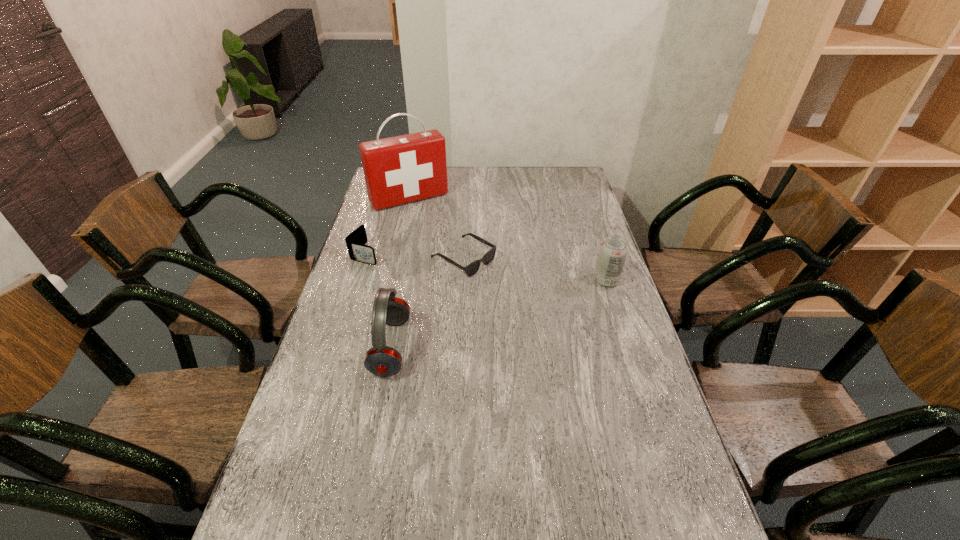
The image size is (960, 540). In order to click on free space located on the ear cups of the nearest object in this screenshot , I will do [x=357, y=347].

This screenshot has height=540, width=960. I want to click on vacant space located 0.390m on the front of the third tallest object, so click(642, 390).

This screenshot has height=540, width=960. I want to click on vacant space positioned at the front lenses of the sunglasses, so (563, 315).

At what (x,y) coordinates should I click in order to perform the action: click on free location located 0.170m at the front lenses of the sunglasses. Please return your answer as a coordinate pair (x, y). Image resolution: width=960 pixels, height=540 pixels. Looking at the image, I should click on point(528,296).

The height and width of the screenshot is (540, 960). I want to click on blank space located at the front lenses of the sunglasses, so click(x=536, y=300).

Locate an element on the screen. This screenshot has height=540, width=960. free location located 0.150m on the outer surface of the fourth tallest object is located at coordinates (416, 269).

This screenshot has height=540, width=960. I want to click on vacant space located on the outer surface of the fourth tallest object, so click(423, 271).

Locate an element on the screen. The image size is (960, 540). free space located on the outer surface of the fourth tallest object is located at coordinates (391, 262).

The width and height of the screenshot is (960, 540). Find the location of `free region located 0.060m on the front face of the farthest object`. free region located 0.060m on the front face of the farthest object is located at coordinates (429, 219).

This screenshot has width=960, height=540. I want to click on blank area located 0.250m on the front face of the farthest object, so click(446, 245).